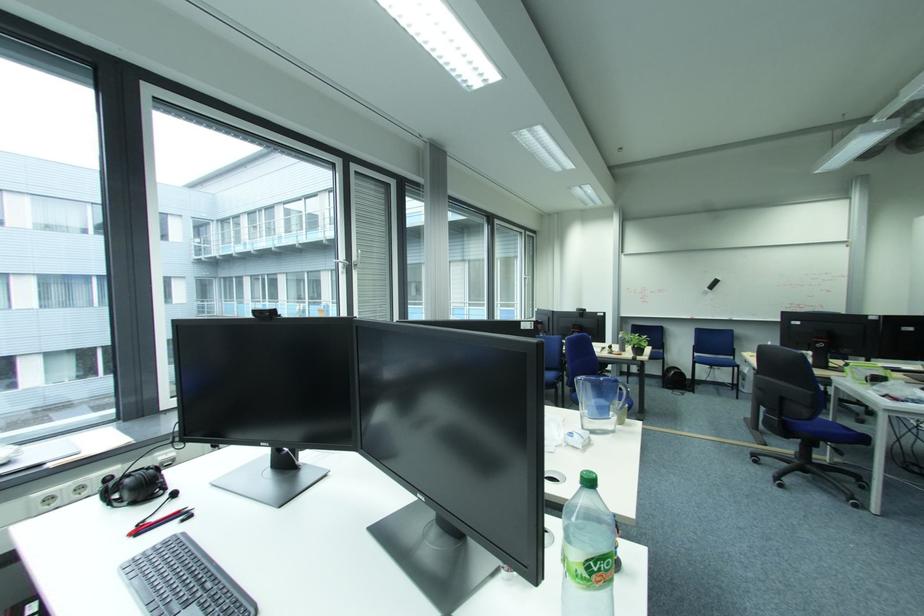
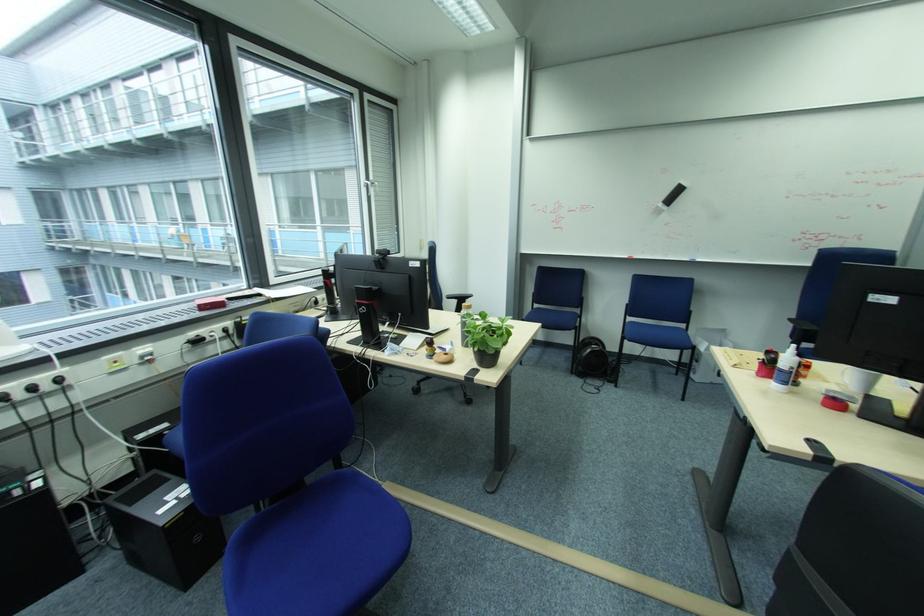
Where in the second image is the point corresponding to (715,291) from the first image?

(669, 206)